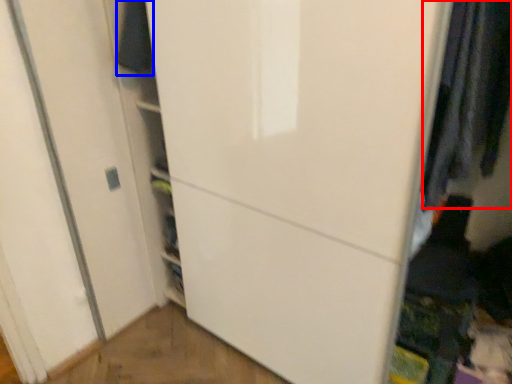
Question: Which object appears farthest to the camera in this image, clothing (highlighted by a red box) or clothing (highlighted by a blue box)?

Choices:
 (A) clothing
 (B) clothing

Answer: (B)